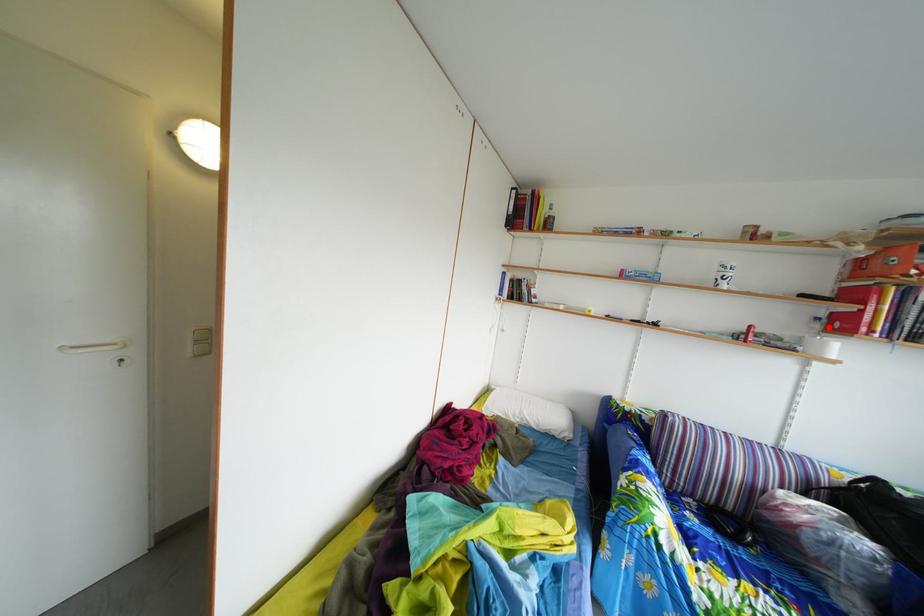
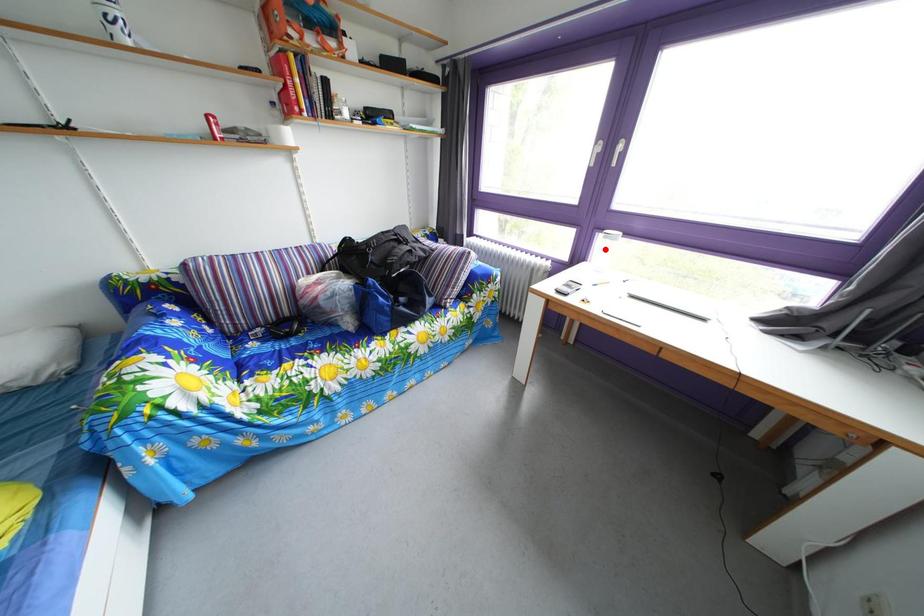
I am providing you with two images of the same scene from different viewpoints. A red point is marked on the first image and another point is marked on the second image. Is the red point in image1 aligned with the point shown in image2?

No